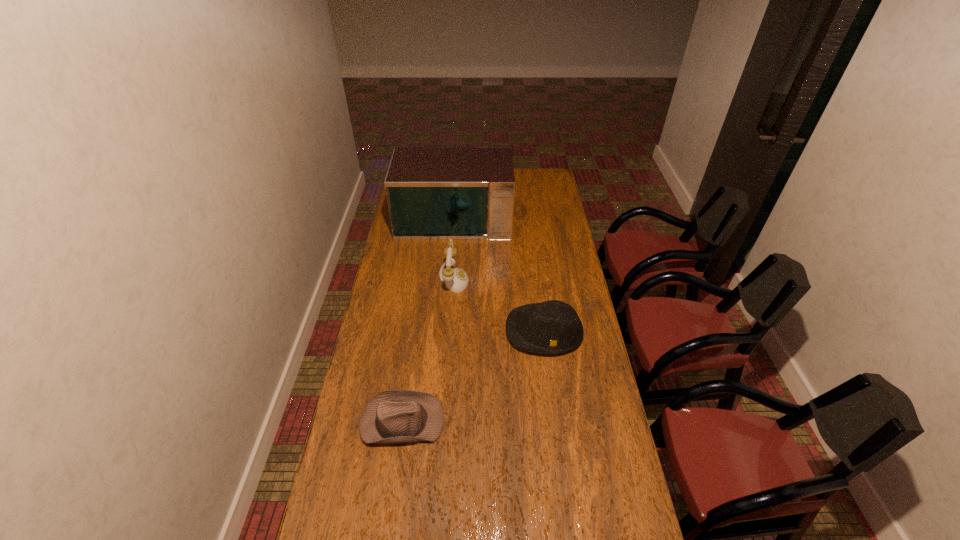
The image size is (960, 540). Identify the location of empty location between the shorter fedora and the tallest object. (428, 319).

This screenshot has width=960, height=540. I want to click on vacant point located between the nearer fedora and the second tallest object, so click(428, 350).

Choose which object is the nearest neighbor to the third shortest object. Please provide its 2D coordinates. Your answer should be formatted as a tuple, i.e. [(x, y)], where the tuple contains the x and y coordinates of a point satisfying the conditions above.

[(551, 327)]

At what (x,y) coordinates should I click in order to perform the action: click on object that is the second closest to the microwave oven. Please return your answer as a coordinate pair (x, y). The image size is (960, 540). Looking at the image, I should click on (551, 327).